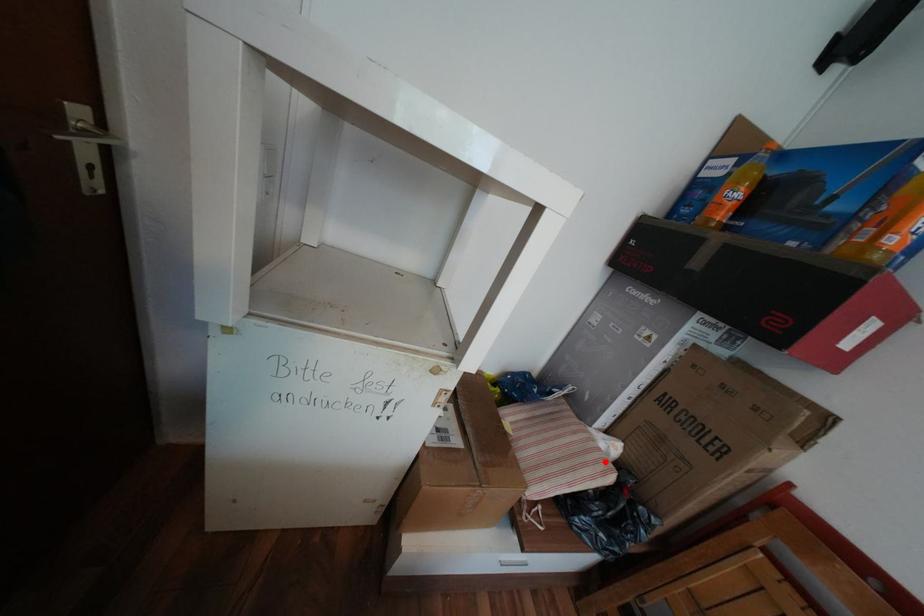
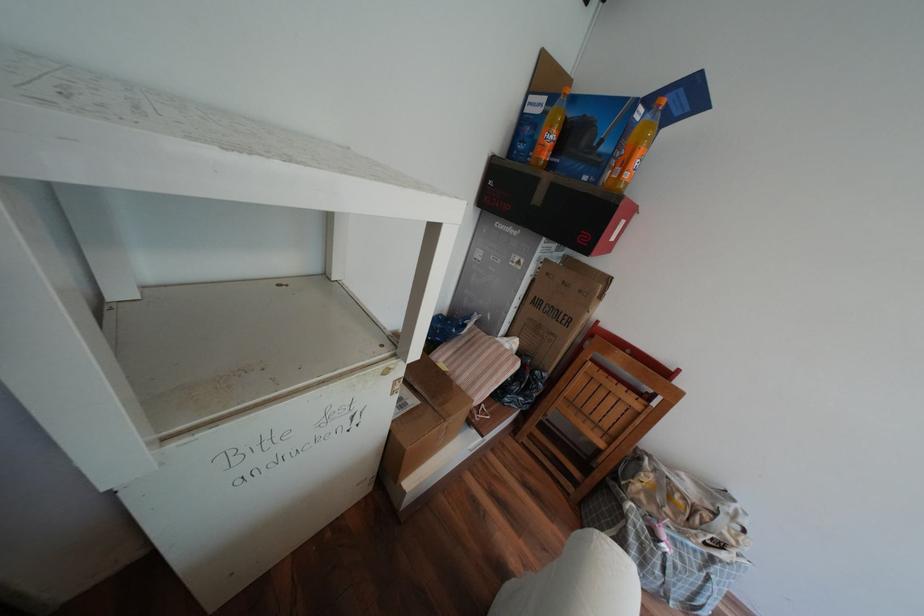
Locate, in the second image, the point that corresponds to the highlighted location in the first image.

(517, 360)